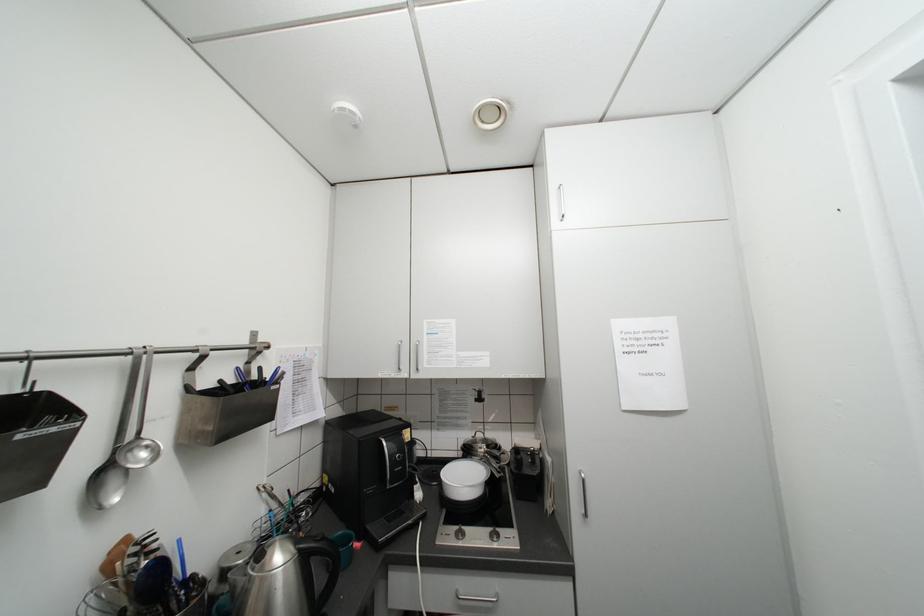
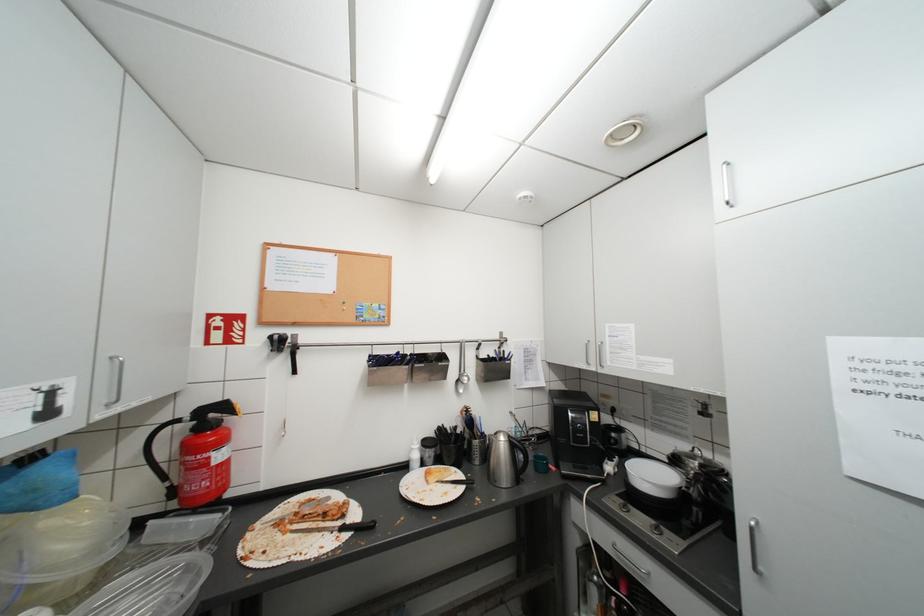
Question: How did the camera likely rotate?

Choices:
 (A) Left
 (B) Right
 (C) Up
 (D) Down

Answer: (A)